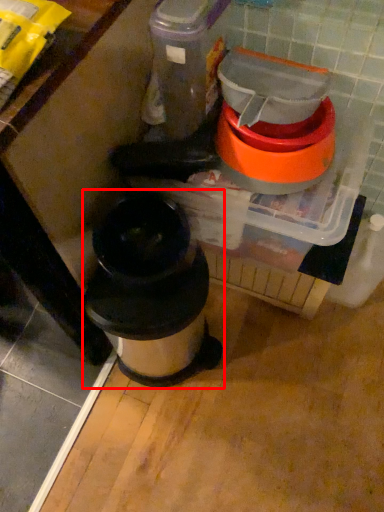
Question: From the image's perspective, what is the correct spatial positioning of waste container (annotated by the red box) in reference to appliance?

Choices:
 (A) below
 (B) above

Answer: (A)